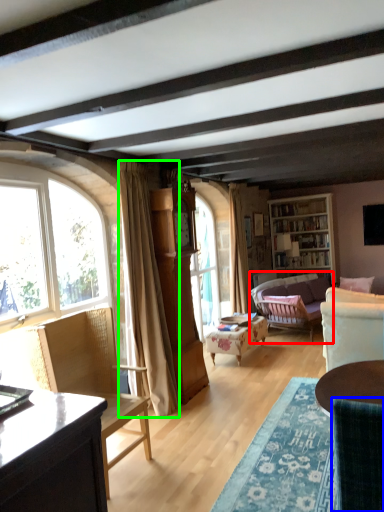
Question: Estimate the real-world distances between objects in this image. Which object is closer to studio couch (highlighted by a red box), chair (highlighted by a blue box) or curtain (highlighted by a green box)?

Choices:
 (A) chair
 (B) curtain

Answer: (B)